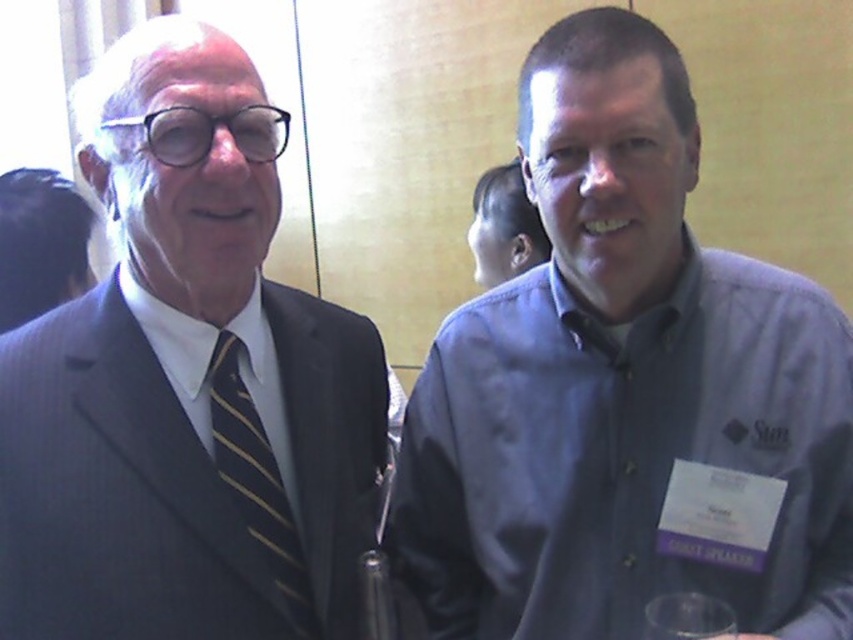
Question: Is blue cotton shirt at center positioned at the back of matte black suit at left?

Choices:
 (A) yes
 (B) no

Answer: (A)

Question: Among these points, which one is farthest from the camera?

Choices:
 (A) (227, 246)
 (B) (259, 502)
 (C) (556, 250)

Answer: (C)

Question: Does matte black suit at left have a smaller size compared to black striped tie at left?

Choices:
 (A) no
 (B) yes

Answer: (A)

Question: Among these points, which one is farthest from the camera?

Choices:
 (A) (210, 92)
 (B) (802, 561)
 (C) (268, 481)

Answer: (B)

Question: Estimate the real-world distances between objects in this image. Which object is closer to the black striped tie at left?

Choices:
 (A) matte black suit at left
 (B) blue cotton shirt at center

Answer: (A)

Question: Is blue cotton shirt at center bigger than black striped tie at left?

Choices:
 (A) yes
 (B) no

Answer: (A)